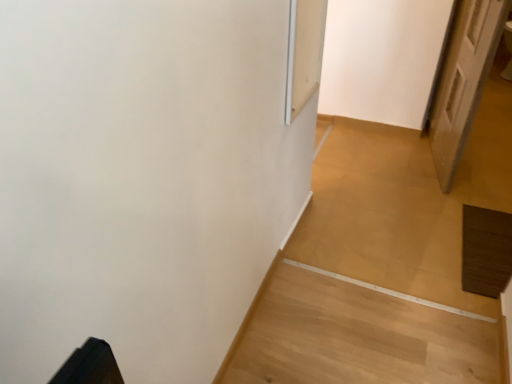
Where is `vacant space in front of white wooden door at right`? This screenshot has height=384, width=512. vacant space in front of white wooden door at right is located at coordinates (451, 204).